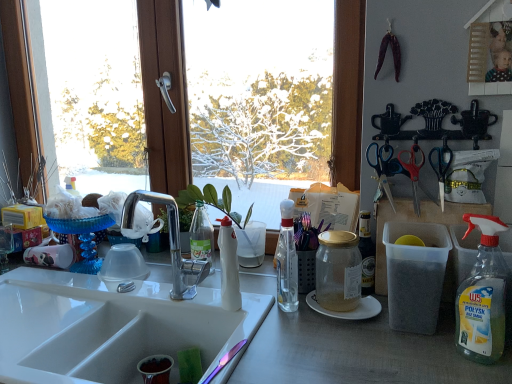
The width and height of the screenshot is (512, 384). In order to click on vacant space that's between clear plastic bottle at right, positioned as the first bottle in right-to-left order, and white matte bottle at center, the fourth bottle from the right in this screenshot , I will do `click(361, 336)`.